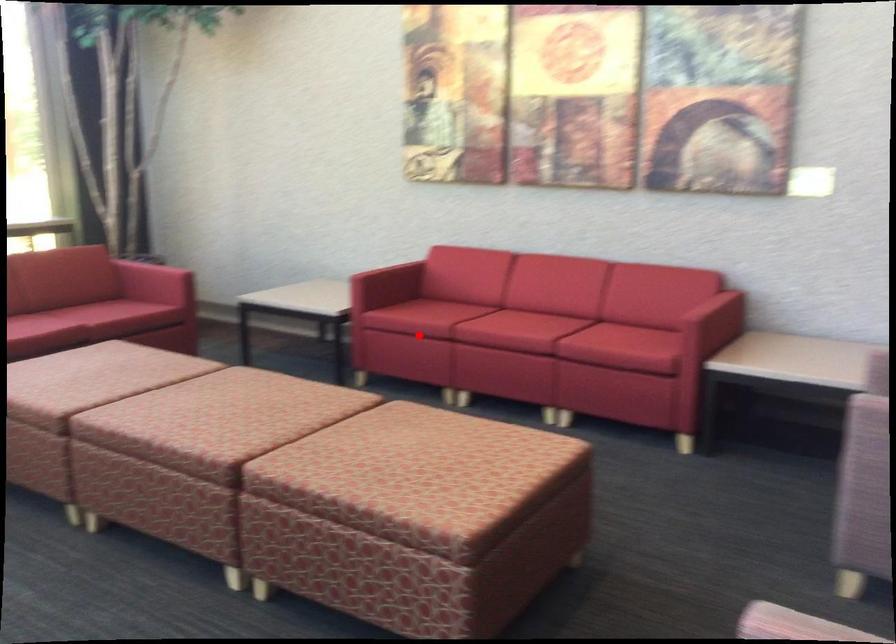
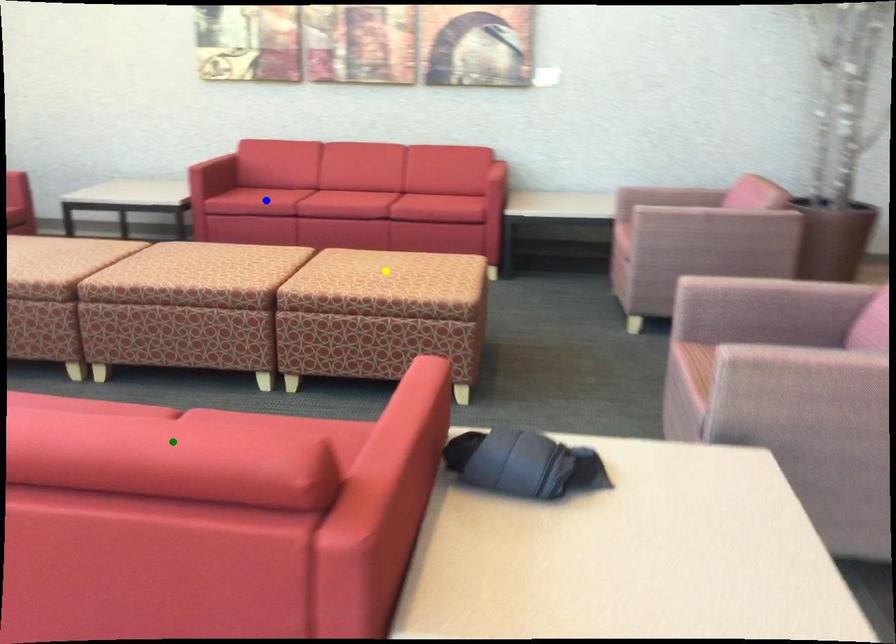
Question: I am providing you with two images of the same scene from different viewpoints. A red point is marked on the first image. You are given multiple points on the second image. Which point in image 2 represents the same 3d spot as the red point in image 1?

Choices:
 (A) blue point
 (B) green point
 (C) yellow point

Answer: (A)